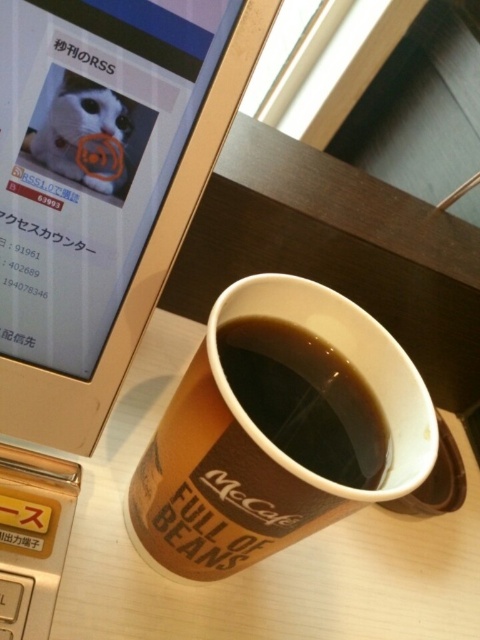
Who is lower down, brown paper cup at center or black paper cup at center?

Positioned lower is brown paper cup at center.

Does brown paper cup at center have a larger size compared to black paper cup at center?

Correct, brown paper cup at center is larger in size than black paper cup at center.

Who is more forward, (223, 298) or (273, 336)?

Point (223, 298)

Find the location of a particular element. brown paper cup at center is located at coordinates (278, 429).